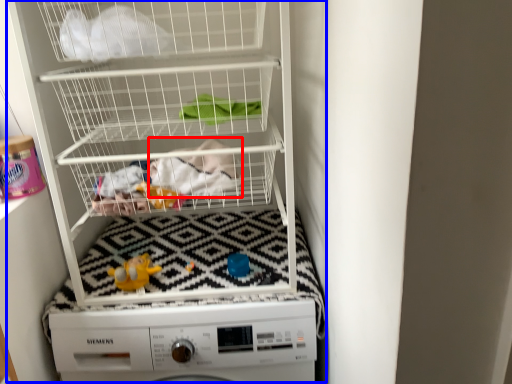
Question: Which point is further to the camera, clothing (highlighted by a red box) or bunk bed (highlighted by a blue box)?

Choices:
 (A) clothing
 (B) bunk bed

Answer: (A)